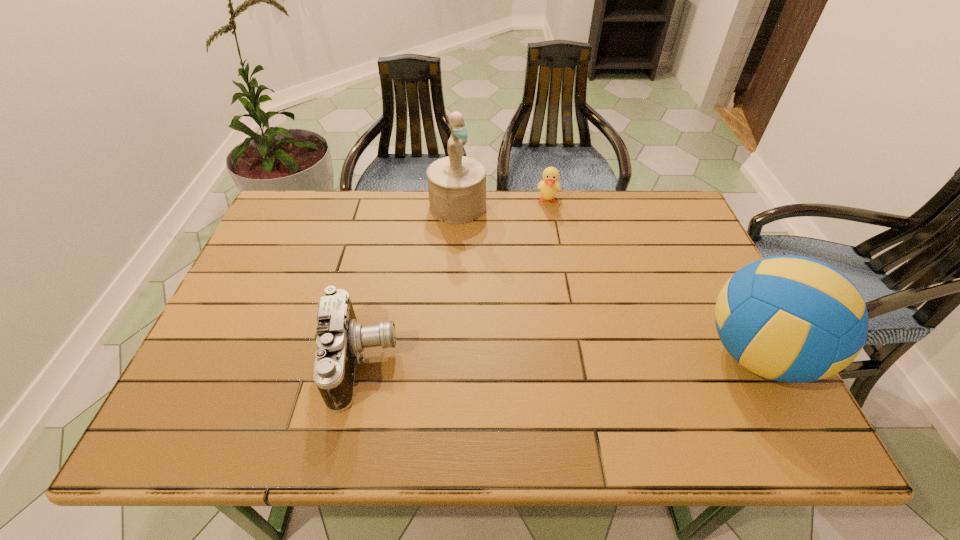
You are a GUI agent. You are given a task and a screenshot of the screen. Output one action in this format:
    pyautogui.click(x=<x>, y=<y>)
    Task: Click on the free space between the third shortest object and the second object from left to right
    The height and width of the screenshot is (540, 960).
    Given the screenshot: What is the action you would take?
    pyautogui.click(x=608, y=280)

Locate an element on the screen. The image size is (960, 540). vacant space that's between the third shortest object and the camera is located at coordinates (560, 358).

Image resolution: width=960 pixels, height=540 pixels. In order to click on free spot between the third shortest object and the leftmost object in this screenshot , I will do `click(560, 358)`.

Find the location of a particular element. The image size is (960, 540). free space that is in between the volleyball and the duckling is located at coordinates (653, 278).

Image resolution: width=960 pixels, height=540 pixels. I want to click on unoccupied area between the leftmost object and the second object from right to left, so click(455, 281).

This screenshot has width=960, height=540. In order to click on free space between the camera and the second object from right to left in this screenshot , I will do `click(455, 281)`.

Locate an element on the screen. free space between the leftmost object and the tallest object is located at coordinates (410, 284).

Image resolution: width=960 pixels, height=540 pixels. In order to click on the second closest object to the second object from right to left in this screenshot , I will do `click(793, 319)`.

At what (x,y) coordinates should I click in order to perform the action: click on object that stands as the second closest to the duckling. Please return your answer as a coordinate pair (x, y). The width and height of the screenshot is (960, 540). Looking at the image, I should click on (793, 319).

Where is `vacant space that satisfies the following two spatial constraints: 1. on the front side of the duckling; 2. on the left side of the volleyball`? This screenshot has width=960, height=540. vacant space that satisfies the following two spatial constraints: 1. on the front side of the duckling; 2. on the left side of the volleyball is located at coordinates (576, 354).